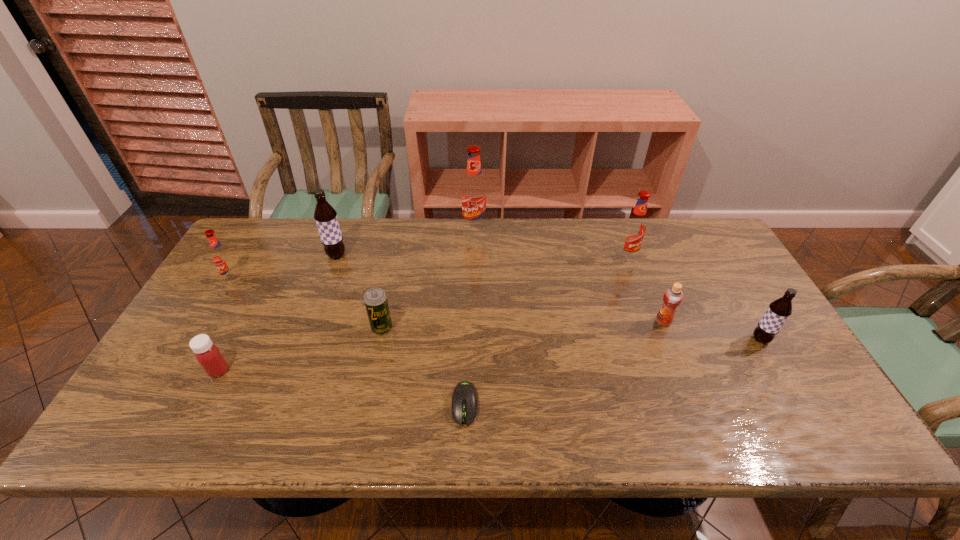
I want to click on free space at the left edge, so click(x=247, y=307).

You are a GUI agent. You are given a task and a screenshot of the screen. Output one action in this format:
    pyautogui.click(x=<x>, y=<y>)
    Task: Click on the free space at the right edge of the desktop
    
    Given the screenshot: What is the action you would take?
    pyautogui.click(x=740, y=293)

Find the location of a particular element. Image resolution: width=960 pixels, height=540 pixels. vacant space at the far left corner of the desktop is located at coordinates (274, 245).

Image resolution: width=960 pixels, height=540 pixels. Find the location of `free space at the far right corner of the desktop`. free space at the far right corner of the desktop is located at coordinates (718, 250).

The image size is (960, 540). I want to click on empty space between the fourth root beer from left to right and the nearest root beer, so click(693, 298).

I want to click on empty space that is in between the gray computer mouse and the farthest root beer, so click(469, 316).

The image size is (960, 540). In order to click on unoccupied area between the seventh object from right to left and the right brown root beer in this screenshot , I will do `click(548, 298)`.

The height and width of the screenshot is (540, 960). Find the location of `free space between the beer can and the fourth root beer from right to left`. free space between the beer can and the fourth root beer from right to left is located at coordinates (x=359, y=292).

Image resolution: width=960 pixels, height=540 pixels. Identify the location of unoccupied position between the orange juice and the left brown root beer. (500, 288).

Image resolution: width=960 pixels, height=540 pixels. Find the location of `vacant area between the fourth root beer from right to left and the second farthest red root beer`. vacant area between the fourth root beer from right to left and the second farthest red root beer is located at coordinates (482, 256).